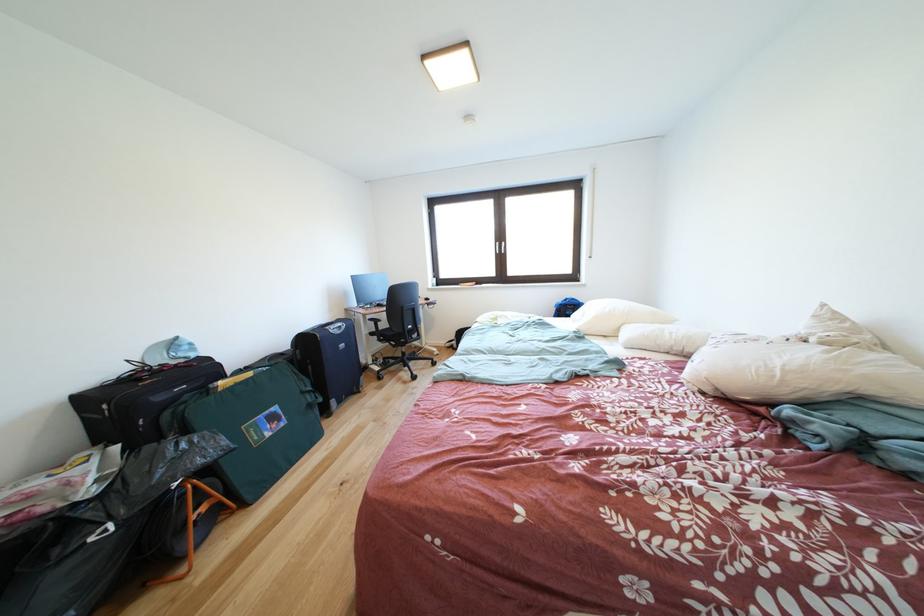
Find the location of a particular element. This screenshot has height=616, width=924. silver window handle is located at coordinates (x=500, y=246).